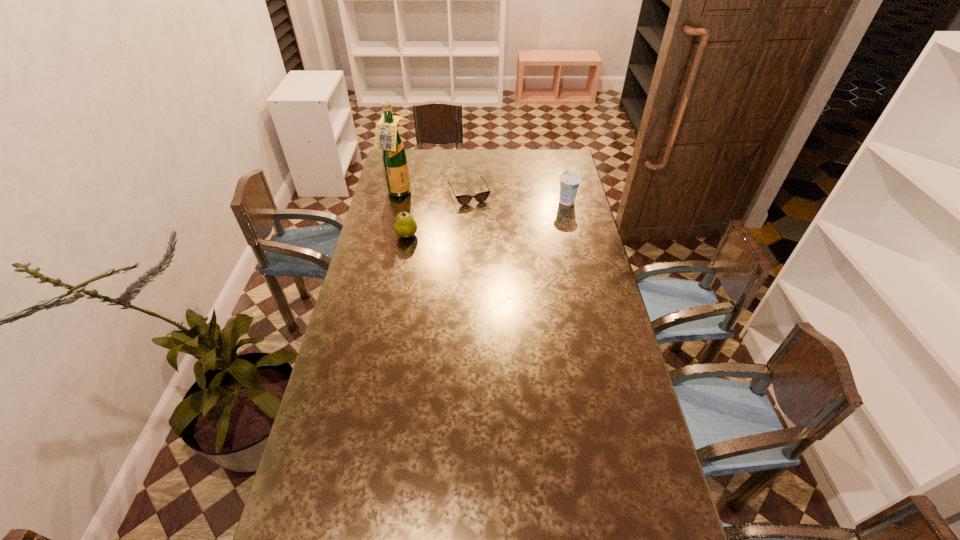
This screenshot has width=960, height=540. What are the coordinates of `free space on the desktop that is between the nearest object and the rightmost object and is positioned on the front-facing side of the liquor` in the screenshot? It's located at (470, 221).

Where is `vacant space on the desktop that is between the nearest object and the rightmost object and is positioned on the front lenses of the third object from left to right`? vacant space on the desktop that is between the nearest object and the rightmost object and is positioned on the front lenses of the third object from left to right is located at coordinates (480, 219).